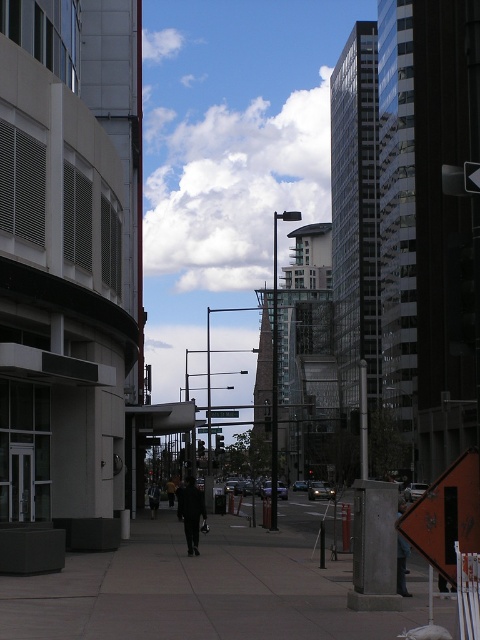
Question: Estimate the real-world distances between objects in this image. Which object is closer to the metallic street sign at center?

Choices:
 (A) dark gray jacket at lower right
 (B) dark wool coat at center

Answer: (B)

Question: Where is dark blue jacket at center located in relation to metallic street sign at center in the image?

Choices:
 (A) below
 (B) above

Answer: (A)

Question: Which object is the closest to the dark wool coat at center?

Choices:
 (A) dark blue jacket at center
 (B) metallic street sign at center

Answer: (B)

Question: Is dark wool coat at center in front of metallic street sign at center?

Choices:
 (A) yes
 (B) no

Answer: (A)

Question: Estimate the real-world distances between objects in this image. Which object is closer to the dark blue jacket at center?

Choices:
 (A) dark wool coat at center
 (B) dark gray jacket at lower right
 (C) metallic street sign at center
 (D) gray concrete sidewalk at center

Answer: (C)

Question: Is gray concrete sidewalk at center smaller than dark blue jacket at center?

Choices:
 (A) yes
 (B) no

Answer: (B)